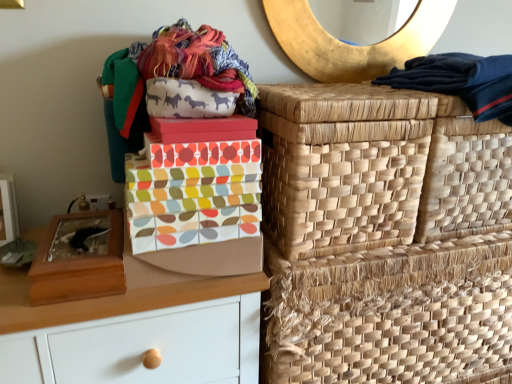
Question: Is multicolored fabric shoe box at center, which is the second shoe box from left to right, taller or shorter than natural woven basket at right, which ranks as the second basket in bottom-to-top order?

Choices:
 (A) tall
 (B) short

Answer: (B)

Question: Relative to natural woven basket at right, which is counted as the second basket, starting from the top, is multicolored fabric shoe box at center, which is the second shoe box from left to right, in front or behind?

Choices:
 (A) behind
 (B) front

Answer: (B)

Question: Considering the real-world distances, which object is farthest from the matte brown chest of drawers at left?

Choices:
 (A) dark blue fabric at upper right
 (B) natural woven basket at upper right, placed as the 3th basket when sorted from bottom to top
 (C) natural woven basket at right, which is counted as the second basket, starting from the top
 (D) gold textured mirror at upper center
 (E) multicolored fabric shoe box at center, which is the second shoe box from left to right

Answer: (D)

Question: Estimate the real-world distances between objects in this image. Which object is farther from the matte brown chest of drawers at left?

Choices:
 (A) natural woven basket at upper right, marked as the 1th basket in a top-to-bottom arrangement
 (B) wooden shoe box at left, which appears as the 1th shoe box when viewed from the left
 (C) natural woven basket at right, the 1th basket ordered from the bottom
 (D) multicolored fabric shoe box at center, which is the second shoe box from left to right
 (E) dark blue fabric at upper right

Answer: (E)